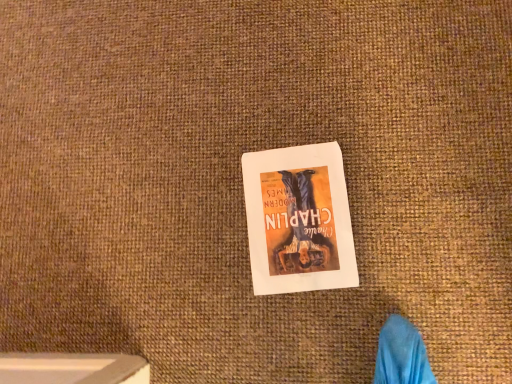
Image resolution: width=512 pixels, height=384 pixels. In order to click on vacant area situated below white paper at center (from a real-world perspective) in this screenshot , I will do `click(298, 221)`.